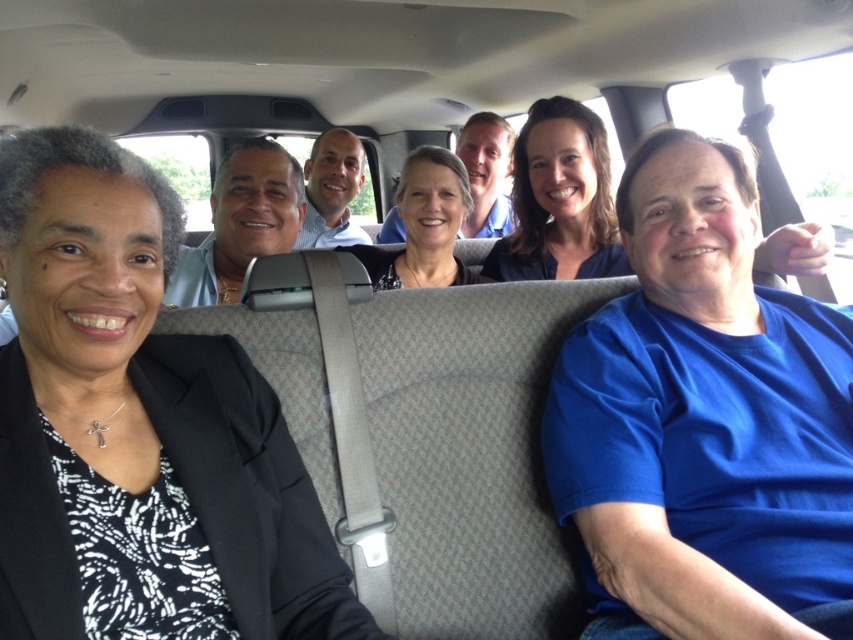
Question: Which point is farther to the camera?

Choices:
 (A) matte blue shirt at center
 (B) black matte blazer at left

Answer: (A)

Question: Which object is closer to the camera taking this photo?

Choices:
 (A) matte blue shirt at center
 (B) matte black hair at center

Answer: (A)

Question: Does black matte blazer at left have a lesser width compared to matte blue shirt at center?

Choices:
 (A) no
 (B) yes

Answer: (A)

Question: Which is nearer to the black matte blazer at left?

Choices:
 (A) matte black hair at center
 (B) matte blue shirt at center

Answer: (A)

Question: Is black matte blazer at left below matte black hair at center?

Choices:
 (A) yes
 (B) no

Answer: (A)

Question: Observing the image, what is the correct spatial positioning of black matte blazer at left in reference to matte blue shirt at center?

Choices:
 (A) below
 (B) above

Answer: (A)